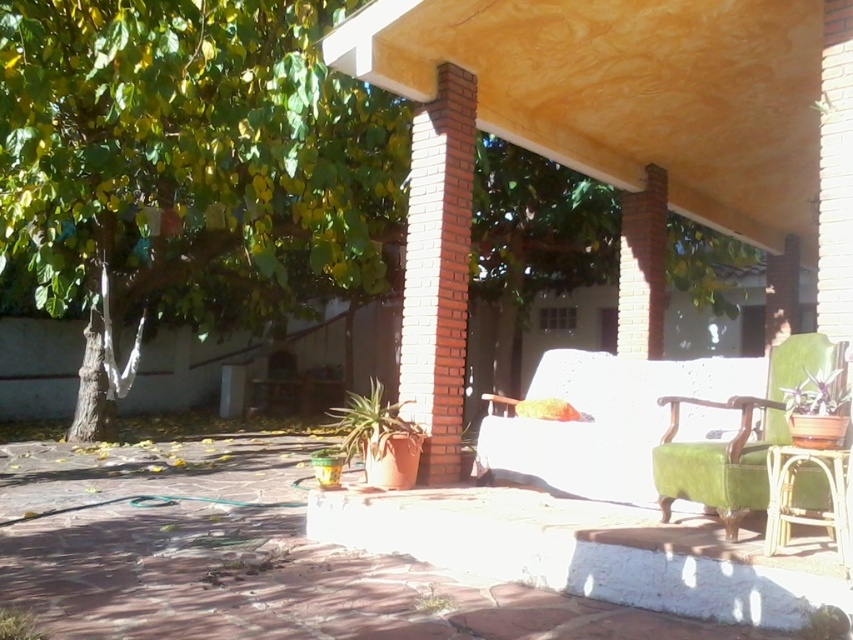
Question: Is green clay pot at center to the left of green matte plant at right from the viewer's perspective?

Choices:
 (A) yes
 (B) no

Answer: (A)

Question: Estimate the real-world distances between objects in this image. Which object is closer to the green wicker chair at right?

Choices:
 (A) velvet green armchair at center
 (B) green clay pot at center

Answer: (A)

Question: Which point appears farthest from the camera in this image?

Choices:
 (A) (373, 445)
 (B) (766, 400)
 (C) (798, 461)
 (D) (90, 209)

Answer: (D)

Question: Can you confirm if velvet green armchair at center is positioned below green matte plant at right?

Choices:
 (A) no
 (B) yes

Answer: (B)

Question: Can you confirm if green leafy tree at upper left is positioned above green clay pot at center?

Choices:
 (A) yes
 (B) no

Answer: (A)

Question: Estimate the real-world distances between objects in this image. Which object is farther from the green clay pot at center?

Choices:
 (A) green wicker chair at right
 (B) velvet green armchair at right
 (C) velvet green armchair at center
 (D) green matte plant at right

Answer: (D)